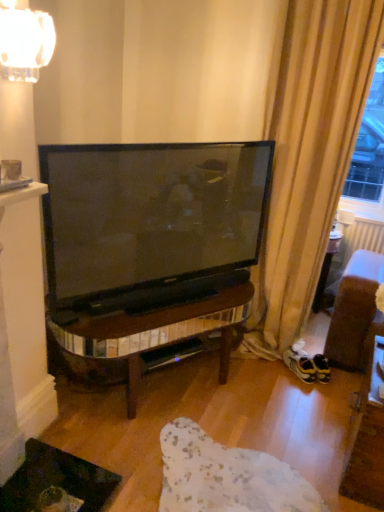
Question: Is the position of clear glass lampshade at upper left more distant than that of yellow suede sneakers at lower right?

Choices:
 (A) no
 (B) yes

Answer: (A)

Question: Considering the relative sizes of clear glass lampshade at upper left and yellow suede sneakers at lower right in the image provided, is clear glass lampshade at upper left wider than yellow suede sneakers at lower right?

Choices:
 (A) yes
 (B) no

Answer: (B)

Question: Is clear glass lampshade at upper left smaller than yellow suede sneakers at lower right?

Choices:
 (A) yes
 (B) no

Answer: (B)

Question: Considering the relative positions of clear glass lampshade at upper left and yellow suede sneakers at lower right in the image provided, is clear glass lampshade at upper left to the right of yellow suede sneakers at lower right from the viewer's perspective?

Choices:
 (A) no
 (B) yes

Answer: (A)

Question: Is clear glass lampshade at upper left with yellow suede sneakers at lower right?

Choices:
 (A) no
 (B) yes

Answer: (A)

Question: Is point (299, 367) closer or farther from the camera than point (311, 226)?

Choices:
 (A) closer
 (B) farther

Answer: (B)

Question: Considering the positions of yellow suede sneakers at lower right and beige fabric curtain at right in the image, is yellow suede sneakers at lower right wider or thinner than beige fabric curtain at right?

Choices:
 (A) wide
 (B) thin

Answer: (B)

Question: Is yellow suede sneakers at lower right in front of or behind beige fabric curtain at right in the image?

Choices:
 (A) front
 (B) behind

Answer: (B)

Question: From a real-world perspective, is yellow suede sneakers at lower right positioned above or below beige fabric curtain at right?

Choices:
 (A) below
 (B) above

Answer: (A)

Question: In terms of width, does beige fabric curtain at right look wider or thinner when compared to matte white mug at upper left?

Choices:
 (A) thin
 (B) wide

Answer: (B)

Question: Considering their positions, is beige fabric curtain at right located in front of or behind matte white mug at upper left?

Choices:
 (A) front
 (B) behind

Answer: (B)

Question: Does point (292, 276) appear closer or farther from the camera than point (13, 166)?

Choices:
 (A) farther
 (B) closer

Answer: (A)

Question: Would you say beige fabric curtain at right is to the left or to the right of matte white mug at upper left in the picture?

Choices:
 (A) right
 (B) left

Answer: (A)

Question: Is clear glass lampshade at upper left in front of or behind yellow suede sneakers at lower right in the image?

Choices:
 (A) behind
 (B) front

Answer: (B)

Question: Is clear glass lampshade at upper left inside or outside of yellow suede sneakers at lower right?

Choices:
 (A) inside
 (B) outside

Answer: (B)